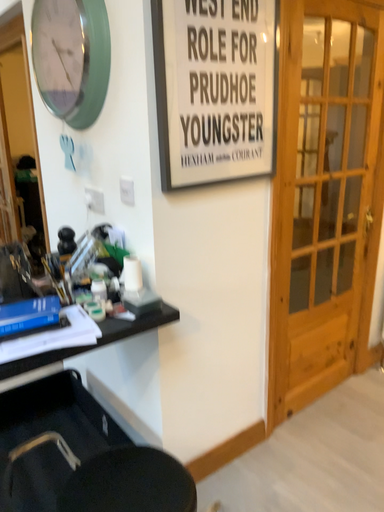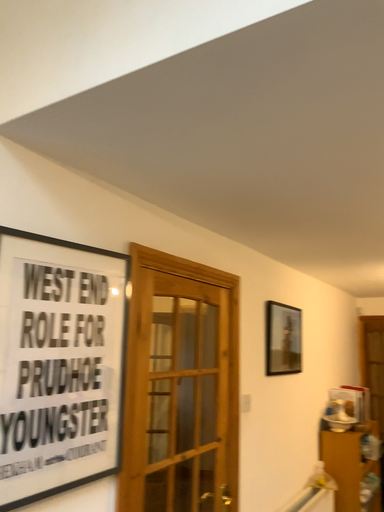
Question: How did the camera likely rotate when shooting the video?

Choices:
 (A) rotated left
 (B) rotated right

Answer: (B)